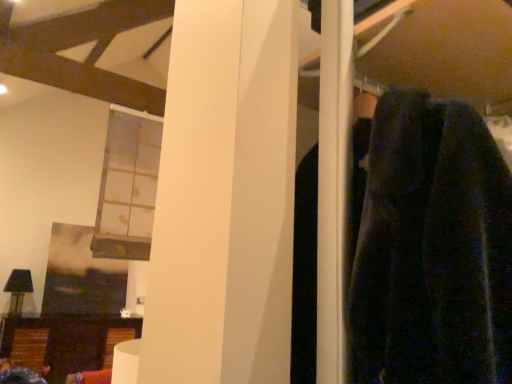
Question: Is point (143, 129) positioned closer to the camera than point (68, 324)?

Choices:
 (A) farther
 (B) closer

Answer: (B)

Question: From a real-world perspective, is translucent glass window at upper left physically located above or below wooden side table at lower left?

Choices:
 (A) above
 (B) below

Answer: (A)

Question: Is translucent glass window at upper left bigger or smaller than wooden side table at lower left?

Choices:
 (A) big
 (B) small

Answer: (B)

Question: From a real-world perspective, is wooden side table at lower left positioned above or below translucent glass window at upper left?

Choices:
 (A) below
 (B) above

Answer: (A)

Question: Choose the correct answer: Is wooden side table at lower left inside translucent glass window at upper left or outside it?

Choices:
 (A) inside
 (B) outside

Answer: (B)

Question: Considering the relative positions of wooden side table at lower left and translucent glass window at upper left in the image provided, is wooden side table at lower left to the left or to the right of translucent glass window at upper left?

Choices:
 (A) right
 (B) left

Answer: (B)

Question: In terms of width, does wooden side table at lower left look wider or thinner when compared to translucent glass window at upper left?

Choices:
 (A) thin
 (B) wide

Answer: (B)